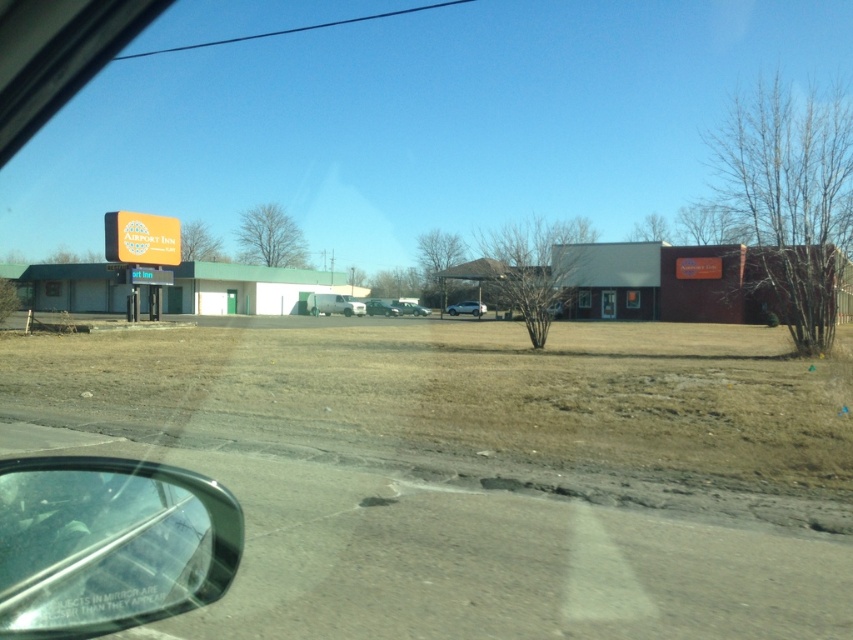
You are driving and see a point marked at coordinates [77,488] in your car mirror. The car mirror says,

The point marked at coordinates [77,488] is 19.93 feet away from the camera, so it is farther than it appears in the mirror.

You are driving a car and notice the transparent glass car window at lower left and the shiny black sedan at center. Which object is closer to you as the driver?

The transparent glass car window at lower left is closer to you because it is in front of the shiny black sedan at center.

You are a passenger in the car and want to look out the transparent glass car window at lower left to see the silver metallic car at center. Which object is narrower when viewed from your perspective?

The transparent glass car window at lower left is thinner than the silver metallic car at center, so the transparent glass car window at lower left is narrower when viewed from your perspective.